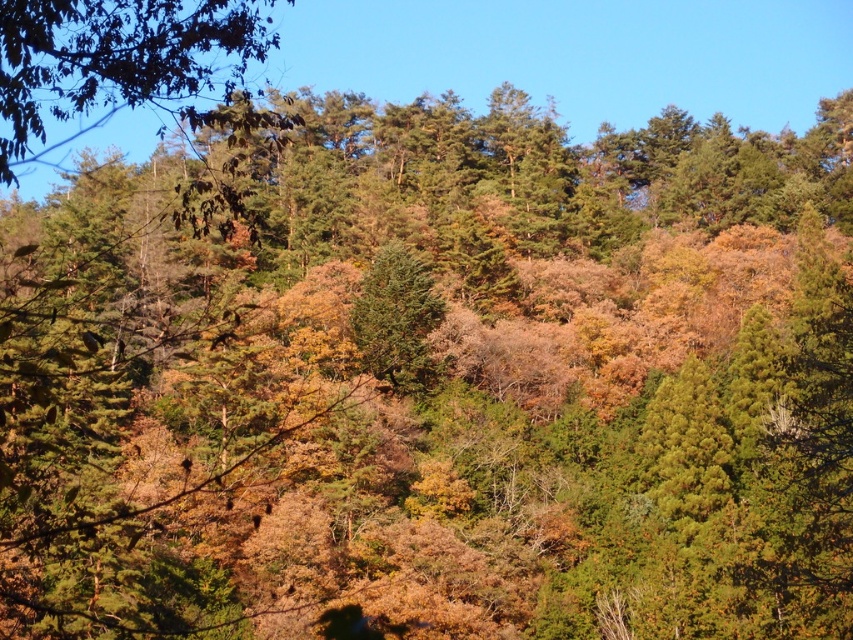
Is green matte tree at upper left positioned behind green matte tree at center?

No, it is not.

Does green matte tree at upper left appear under green matte tree at center?

No, green matte tree at upper left is not below green matte tree at center.

Between point (190, 116) and point (376, 301), which one is positioned behind?

The point (376, 301) is behind.

Identify the location of green matte tree at upper left. This screenshot has width=853, height=640. (119, 60).